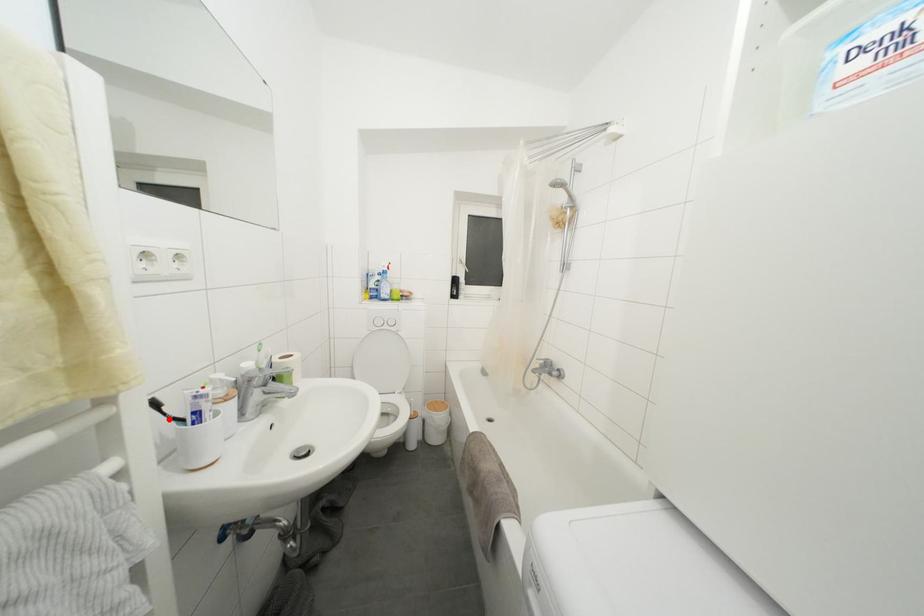
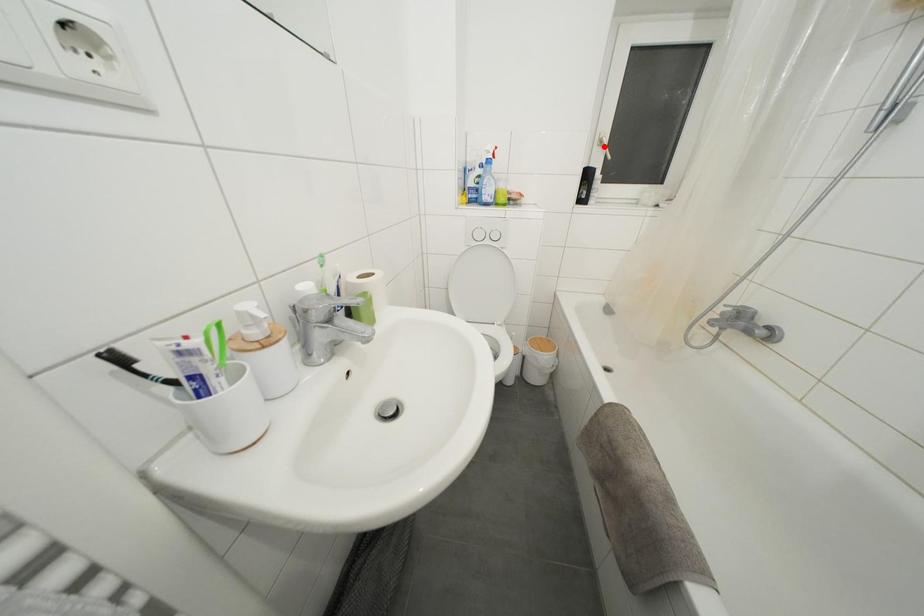
I am providing you with two images of the same scene from different viewpoints. A red point is marked on the first image and another point is marked on the second image. Do the highlighted points in image1 and image2 indicate the same real-world spot?

No